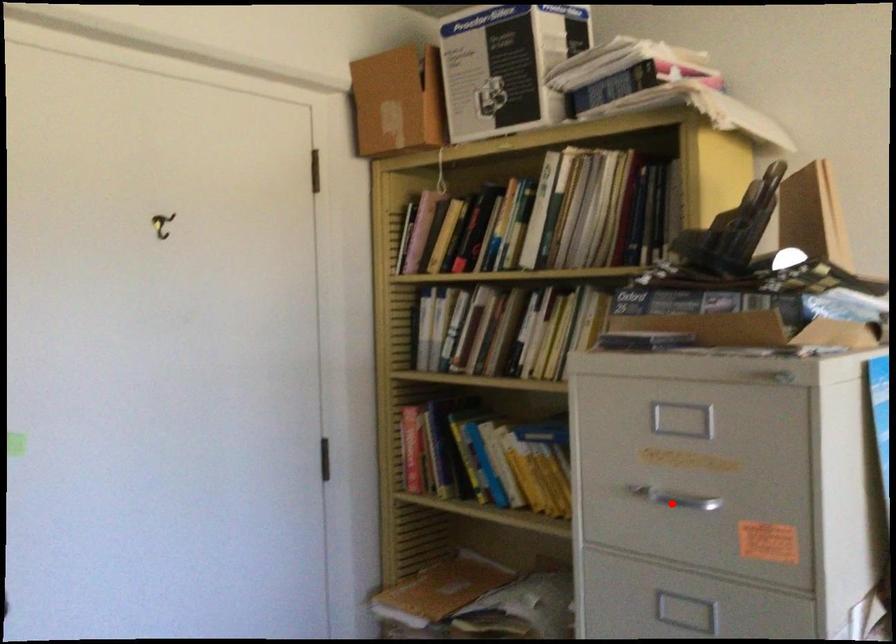
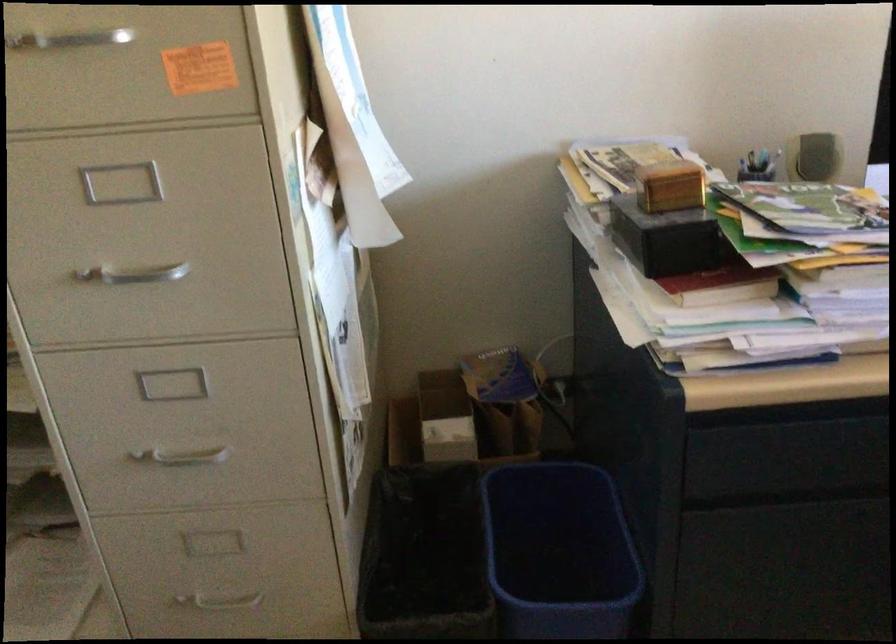
Question: I am providing you with two images of the same scene from different viewpoints. A red point is shown in image1. For the corresponding object point in image2, is it positioned nearer or farther from the camera?

Choices:
 (A) Nearer
 (B) Farther

Answer: (A)